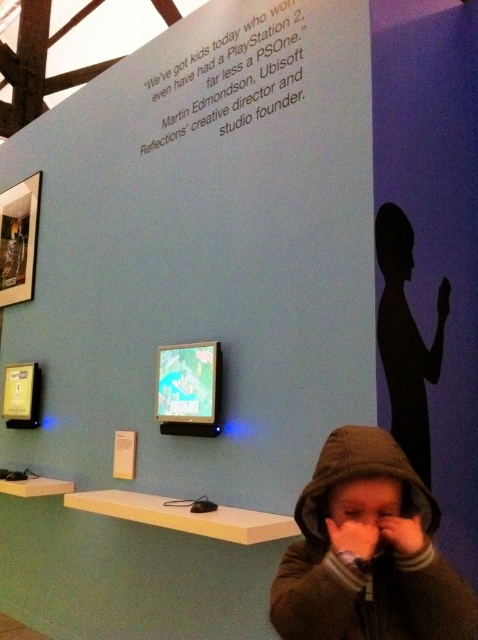
Consider the image. Is brown fleece hoodie at lower right positioned before pink matte nose at center?

Yes, it is in front of pink matte nose at center.

Who is more forward, [360,618] or [360,516]?

Point [360,516] is in front.

Where is `brown fleece hoodie at lower right`? The image size is (478, 640). brown fleece hoodie at lower right is located at coordinates (368, 552).

Does black silhouette phone at right have a lesser height compared to pink matte nose at center?

No.

Is black silhouette phone at right to the right of pink matte nose at center from the viewer's perspective?

Yes, black silhouette phone at right is to the right of pink matte nose at center.

Is point (431, 474) closer to viewer compared to point (370, 518)?

No, it is behind (370, 518).

Image resolution: width=478 pixels, height=640 pixels. Find the location of `black silhouette phone at right`. black silhouette phone at right is located at coordinates (405, 339).

Which is above, brown fleece hoodie at lower right or black silhouette phone at right?

black silhouette phone at right

In the scene shown: Who is more distant from viewer, [312,536] or [416,454]?

Positioned behind is point [416,454].

Is point (315, 500) positioned after point (392, 435)?

No, (315, 500) is closer to viewer.

At what (x,y) coordinates should I click in order to perform the action: click on brown fleece hoodie at lower right. Please return your answer as a coordinate pair (x, y). Looking at the image, I should click on (368, 552).